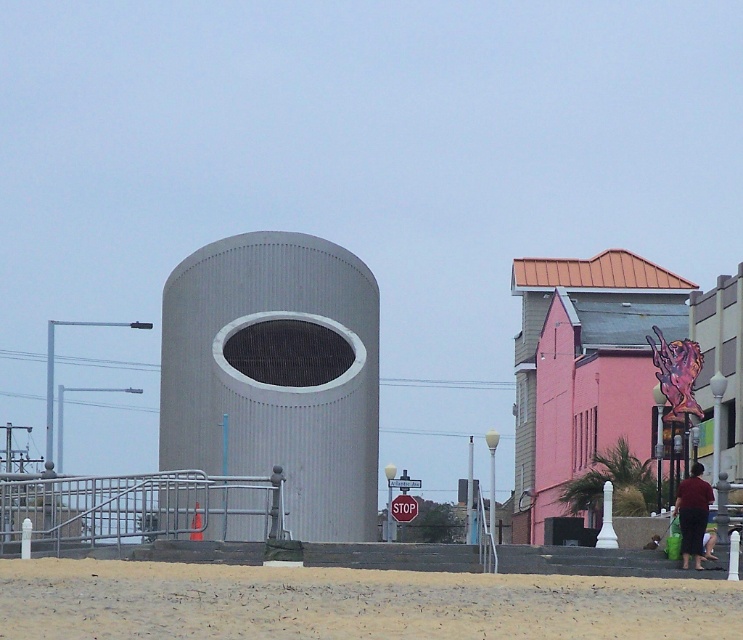
You are a delivery person standing on the sandy beach area. You need to place a small package on the tallest object in the scene. Which object should you choose between the dark red fabric pants at lower right and the red plastic stop sign at center?

The red plastic stop sign at center is taller than the dark red fabric pants at lower right, so you should place the package on the red plastic stop sign at center.

You are standing at the center of the sandy beach area in the urban scene. You see a dark red fabric pants at lower right located at point (692, 513). If you walk straight ahead, will you reach the large cylindrical structure on the left before reaching the dark red fabric pants at lower right?

The dark red fabric pants at lower right is located at point (692, 513). Since the large cylindrical structure is on the left side of the image and the pants are at lower right, walking straight ahead from the center would first encounter the pants before reaching the structure. However, without specific distance data, this is an assumption based on their positions.

You are standing on the sandy beach and want to walk from the gray corrugated metal cylinder at center to the dark red fabric pants at lower right. Which direction should you face to walk directly towards them?

You should face to the right because the gray corrugated metal cylinder at center is to the left of dark red fabric pants at lower right.